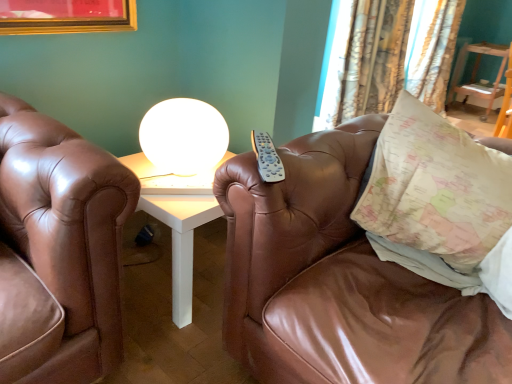
What is the approximate width of patterned fabric curtain at upper right, acting as the 2th curtain starting from the right?

It is 15.30 inches.

Identify the location of wooden table at upper right. Image resolution: width=512 pixels, height=384 pixels. (476, 74).

What do you see at coordinates (476, 74) in the screenshot? The image size is (512, 384). I see `wooden table at upper right` at bounding box center [476, 74].

Locate an element on the screen. This screenshot has height=384, width=512. map-patterned fabric pillow at right is located at coordinates (435, 188).

Image resolution: width=512 pixels, height=384 pixels. In order to click on brown leather couch at center in this screenshot , I will do `click(339, 281)`.

At what (x,y) coordinates should I click in order to perform the action: click on white glossy sphere at upper center. Please return your answer as a coordinate pair (x, y). The width and height of the screenshot is (512, 384). Looking at the image, I should click on (184, 136).

Who is more distant, patterned fabric curtain at upper right, placed as the 1th curtain when sorted from front to back, or white glossy sphere at upper center?

patterned fabric curtain at upper right, placed as the 1th curtain when sorted from front to back, is behind.

There is a white glossy sphere at upper center. Where is `curtain above it (from a real-world perspective)`? curtain above it (from a real-world perspective) is located at coordinates (388, 56).

Who is smaller, patterned fabric curtain at upper right, acting as the 2th curtain starting from the right, or white glossy sphere at upper center?

white glossy sphere at upper center.

Considering the relative positions of patterned fabric curtain at upper right, which is the 1th curtain from left to right, and wooden table at upper right in the image provided, is patterned fabric curtain at upper right, which is the 1th curtain from left to right, to the left or to the right of wooden table at upper right?

From the image, it's evident that patterned fabric curtain at upper right, which is the 1th curtain from left to right, is to the left of wooden table at upper right.

From the image's perspective, which is above, patterned fabric curtain at upper right, which is the 1th curtain from left to right, or wooden table at upper right?

From the image's view, wooden table at upper right is above.

Which object is wider, patterned fabric curtain at upper right, placed as the 1th curtain when sorted from front to back, or wooden table at upper right?

wooden table at upper right.

Which is nearer, (313, 127) or (495, 80)?

Point (313, 127) is closer to the camera than point (495, 80).

Is map-patterned fabric pillow at right to the left or to the right of patterned fabric curtain at upper right, acting as the 2th curtain starting from the right, in the image?

In the image, map-patterned fabric pillow at right appears on the left side of patterned fabric curtain at upper right, acting as the 2th curtain starting from the right.

How much distance is there between map-patterned fabric pillow at right and patterned fabric curtain at upper right, placed as the 1th curtain when sorted from front to back?

map-patterned fabric pillow at right is 6.49 feet away from patterned fabric curtain at upper right, placed as the 1th curtain when sorted from front to back.

Is map-patterned fabric pillow at right touching patterned fabric curtain at upper right, placed as the 1th curtain when sorted from front to back?

No, map-patterned fabric pillow at right is not beside patterned fabric curtain at upper right, placed as the 1th curtain when sorted from front to back.

Which of these two, map-patterned fabric pillow at right or patterned fabric curtain at upper right, which is the 1th curtain from left to right, is smaller?

With smaller size is map-patterned fabric pillow at right.

Between wooden table at upper right and patterned fabric curtain at upper right, the 2th curtain in the left-to-right sequence, which one has larger width?

patterned fabric curtain at upper right, the 2th curtain in the left-to-right sequence, is wider.

Is patterned fabric curtain at upper right, arranged as the second curtain when viewed from the front, surrounded by wooden table at upper right?

No, patterned fabric curtain at upper right, arranged as the second curtain when viewed from the front, is not inside wooden table at upper right.

Is wooden table at upper right with patterned fabric curtain at upper right, arranged as the second curtain when viewed from the front?

wooden table at upper right is not next to patterned fabric curtain at upper right, arranged as the second curtain when viewed from the front, and they're not touching.

Is map-patterned fabric pillow at right positioned far away from wooden table at upper right?

Absolutely, map-patterned fabric pillow at right is distant from wooden table at upper right.

This screenshot has height=384, width=512. Find the location of `pillow in front of the wooden table at upper right`. pillow in front of the wooden table at upper right is located at coordinates (435, 188).

Is map-patterned fabric pillow at right taller than wooden table at upper right?

No.

Measure the distance from map-patterned fabric pillow at right to wooden table at upper right.

map-patterned fabric pillow at right and wooden table at upper right are 3.89 meters apart.

Does patterned fabric curtain at upper right, the 1th curtain in the right-to-left sequence, touch brown leather couch at center?

No, patterned fabric curtain at upper right, the 1th curtain in the right-to-left sequence, is not in contact with brown leather couch at center.

Could you tell me if patterned fabric curtain at upper right, arranged as the second curtain when viewed from the front, is turned towards brown leather couch at center?

No.

Is point (417, 88) closer or farther from the camera than point (239, 360)?

Point (417, 88) is farther from the camera than point (239, 360).

Is point (359, 306) positioned after point (440, 100)?

No, it is in front of (440, 100).

Is brown leather couch at center facing away from patterned fabric curtain at upper right, which ranks as the first curtain in back-to-front order?

Yes, brown leather couch at center is facing away from patterned fabric curtain at upper right, which ranks as the first curtain in back-to-front order.

Based on their sizes in the image, would you say brown leather couch at center is bigger or smaller than patterned fabric curtain at upper right, the 1th curtain in the right-to-left sequence?

Considering their sizes, brown leather couch at center takes up more space than patterned fabric curtain at upper right, the 1th curtain in the right-to-left sequence.

I want to click on curtain that is the 1st one when counting backward from the white glossy sphere at upper center, so click(388, 56).

You are a GUI agent. You are given a task and a screenshot of the screen. Output one action in this format:
    pyautogui.click(x=<x>, y=<y>)
    Task: Click on the 2nd curtain to the left when counting from the wooden table at upper right
    
    Given the screenshot: What is the action you would take?
    pyautogui.click(x=388, y=56)

When comparing their distances from brown leather couch at center, does patterned fabric curtain at upper right, which ranks as the first curtain in back-to-front order, or map-patterned fabric pillow at right seem closer?

Among the two, map-patterned fabric pillow at right is located nearer to brown leather couch at center.

Looking at the image, which one is located further to wooden table at upper right, map-patterned fabric pillow at right or brown leather couch at center?

brown leather couch at center.

When comparing their distances from white glossy sphere at upper center, does brown leather couch at center or patterned fabric curtain at upper right, placed as the 1th curtain when sorted from front to back, seem closer?

brown leather couch at center is positioned closer to the anchor white glossy sphere at upper center.

Looking at the image, which one is located closer to wooden table at upper right, brown leather couch at center or map-patterned fabric pillow at right?

map-patterned fabric pillow at right.

Based on their spatial positions, is white glossy sphere at upper center or patterned fabric curtain at upper right, which ranks as the first curtain in back-to-front order, closer to wooden table at upper right?

Based on the image, patterned fabric curtain at upper right, which ranks as the first curtain in back-to-front order, appears to be nearer to wooden table at upper right.

Looking at this image, estimate the real-world distances between objects in this image. Which object is further from patterned fabric curtain at upper right, arranged as the second curtain when viewed from the front, patterned fabric curtain at upper right, placed as the 1th curtain when sorted from front to back, or wooden table at upper right?

Among the two, patterned fabric curtain at upper right, placed as the 1th curtain when sorted from front to back, is located further to patterned fabric curtain at upper right, arranged as the second curtain when viewed from the front.

When comparing their distances from brown leather couch at center, does map-patterned fabric pillow at right or patterned fabric curtain at upper right, the 1th curtain in the right-to-left sequence, seem closer?

map-patterned fabric pillow at right lies closer to brown leather couch at center than the other object.

When comparing their distances from wooden table at upper right, does map-patterned fabric pillow at right or patterned fabric curtain at upper right, arranged as the second curtain when viewed from the front, seem further?

The object further to wooden table at upper right is map-patterned fabric pillow at right.

You are a GUI agent. You are given a task and a screenshot of the screen. Output one action in this format:
    pyautogui.click(x=<x>, y=<y>)
    Task: Click on the curtain between brown leather couch at center and patterned fabric curtain at upper right, the 1th curtain in the right-to-left sequence, along the z-axis
    This screenshot has width=512, height=384.
    Given the screenshot: What is the action you would take?
    pyautogui.click(x=388, y=56)

At what (x,y) coordinates should I click in order to perform the action: click on table lamp between brown leather couch at center and patterned fabric curtain at upper right, acting as the 2th curtain starting from the right, in the front-back direction. Please return your answer as a coordinate pair (x, y). The height and width of the screenshot is (384, 512). Looking at the image, I should click on (184, 136).

Find the location of a particular element. The image size is (512, 384). table lamp positioned between brown leather couch at center and wooden table at upper right from near to far is located at coordinates (184, 136).

I want to click on pillow between brown leather couch at center and patterned fabric curtain at upper right, the 2th curtain positioned from the back, along the z-axis, so click(435, 188).